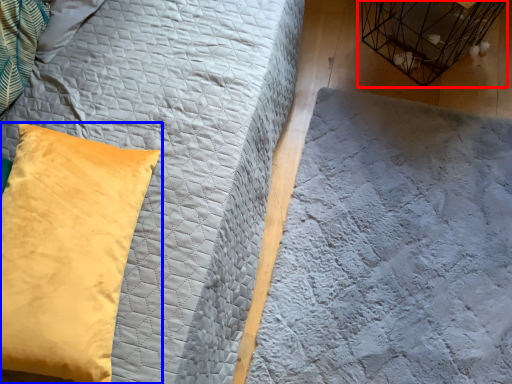
Question: Which of the following is the closest to the observer, bird cage (highlighted by a red box) or pillow (highlighted by a blue box)?

Choices:
 (A) bird cage
 (B) pillow

Answer: (B)